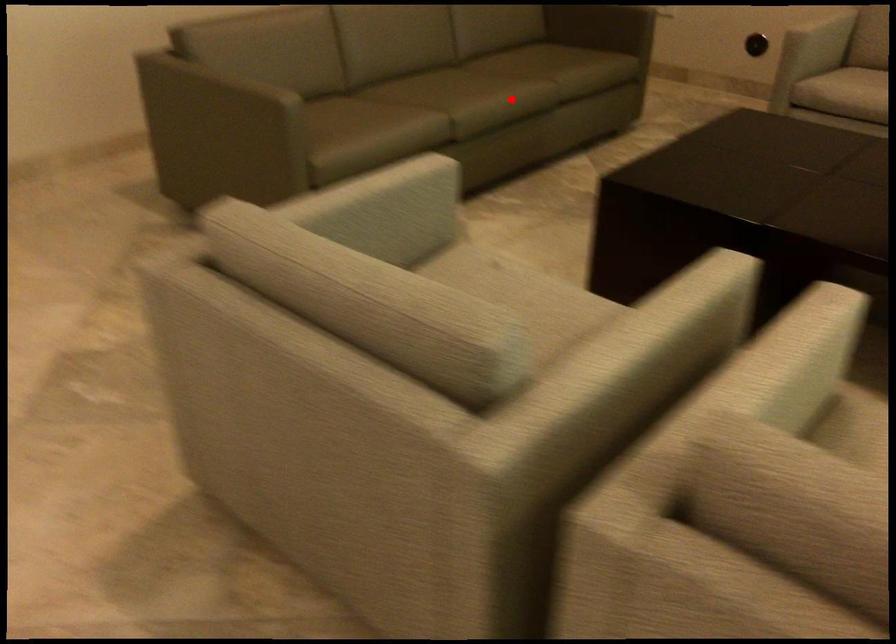
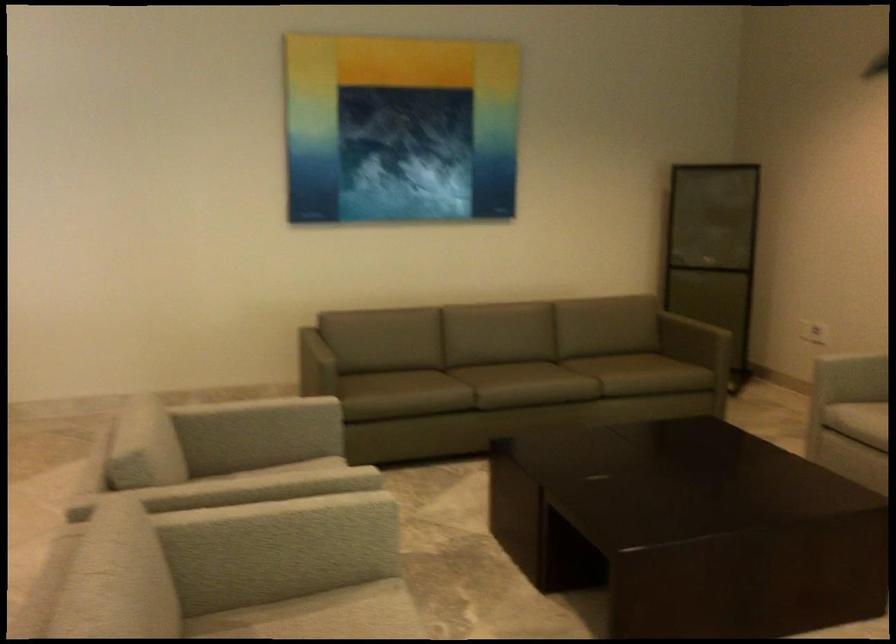
Question: I am providing you with two images of the same scene from different viewpoints. Given a red point in image1, look at the same physical point in image2. Is it:

Choices:
 (A) Closer to the viewpoint
 (B) Farther from the viewpoint

Answer: (B)